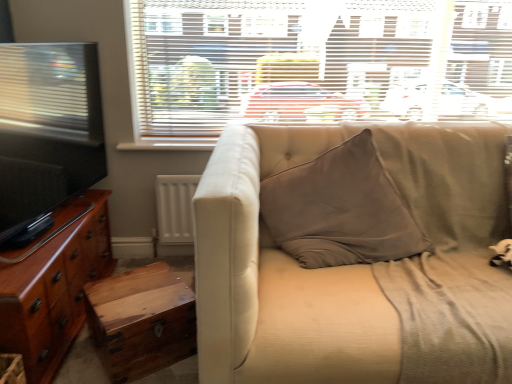
Question: Does white textured blinds at upper center have a smaller size compared to beige fabric couch at center?

Choices:
 (A) yes
 (B) no

Answer: (A)

Question: Can you confirm if white textured blinds at upper center is wider than beige fabric couch at center?

Choices:
 (A) yes
 (B) no

Answer: (B)

Question: Considering the relative sizes of white textured blinds at upper center and beige fabric couch at center in the image provided, is white textured blinds at upper center bigger than beige fabric couch at center?

Choices:
 (A) yes
 (B) no

Answer: (B)

Question: Does white textured blinds at upper center appear on the right side of beige fabric couch at center?

Choices:
 (A) no
 (B) yes

Answer: (A)

Question: Can you confirm if white textured blinds at upper center is taller than beige fabric couch at center?

Choices:
 (A) yes
 (B) no

Answer: (B)

Question: Is white textured blinds at upper center outside of beige fabric couch at center?

Choices:
 (A) yes
 (B) no

Answer: (A)

Question: From a real-world perspective, is beige fabric couch at center on top of glossy wood cabinet at left?

Choices:
 (A) no
 (B) yes

Answer: (B)

Question: Considering the relative positions of beige fabric couch at center and glossy wood cabinet at left in the image provided, is beige fabric couch at center behind glossy wood cabinet at left?

Choices:
 (A) yes
 (B) no

Answer: (B)

Question: Is beige fabric couch at center completely or partially outside of glossy wood cabinet at left?

Choices:
 (A) yes
 (B) no

Answer: (A)

Question: Is beige fabric couch at center taller than glossy wood cabinet at left?

Choices:
 (A) yes
 (B) no

Answer: (A)

Question: Is beige fabric couch at center positioned with its back to glossy wood cabinet at left?

Choices:
 (A) no
 (B) yes

Answer: (A)

Question: Is beige fabric couch at center smaller than glossy wood cabinet at left?

Choices:
 (A) no
 (B) yes

Answer: (A)

Question: Is the surface of beige fabric couch at center in direct contact with white textured blinds at upper center?

Choices:
 (A) no
 (B) yes

Answer: (A)